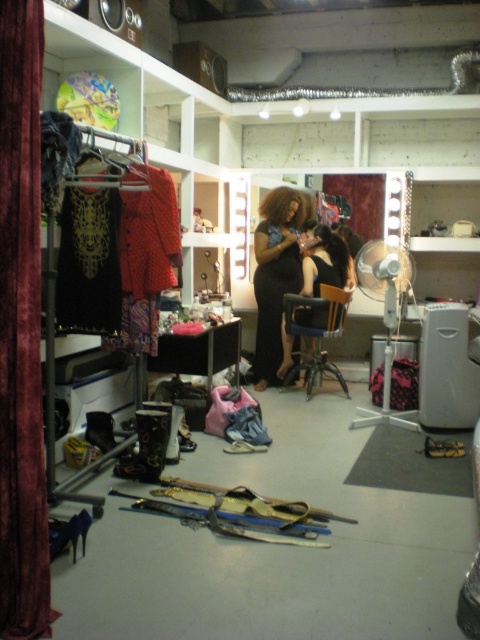
You are a stylist trying to organize the dressing room. You notice the black lace dress at left and the black matte hair at center. Which object is taller?

The black lace dress at left is much taller than the black matte hair at center.

You are standing in a busy dressing room and need to quickly exit through the nearest door. The velvet curtain at left is the only exit available. Can you reach it within 3 steps if each step you take is about 2 feet long?

The velvet curtain at left is 6.27 feet away from viewer. Since each step is 2 feet, 3 steps would cover 6 feet. The distance is slightly more than 6 feet, so you would need an extra step to reach the velvet curtain at left.

You are a stylist trying to hang the shiny black dress at center on a hook that is currently holding the black leather chair at center. Can you hang the dress without removing the chair?

The shiny black dress at center is much taller than the black leather chair at center, so it may not fit on the hook without removing the chair first.